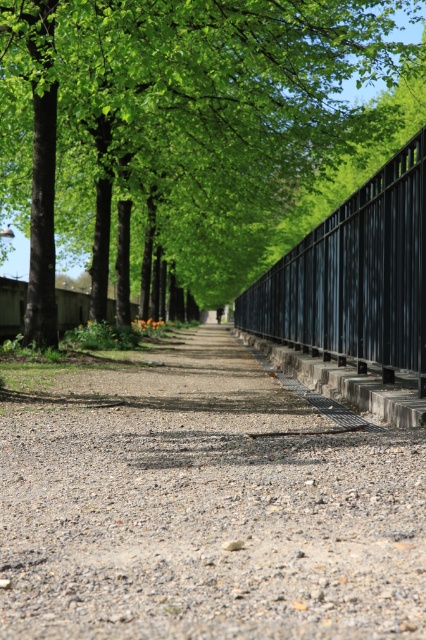
You are standing on the pathway and want to walk towards the black metal fence at right. Which direction should you turn to face the green leafy tree at center before proceeding?

You should turn to your left to face the green leafy tree at center because it is to the right of the black metal fence at right.